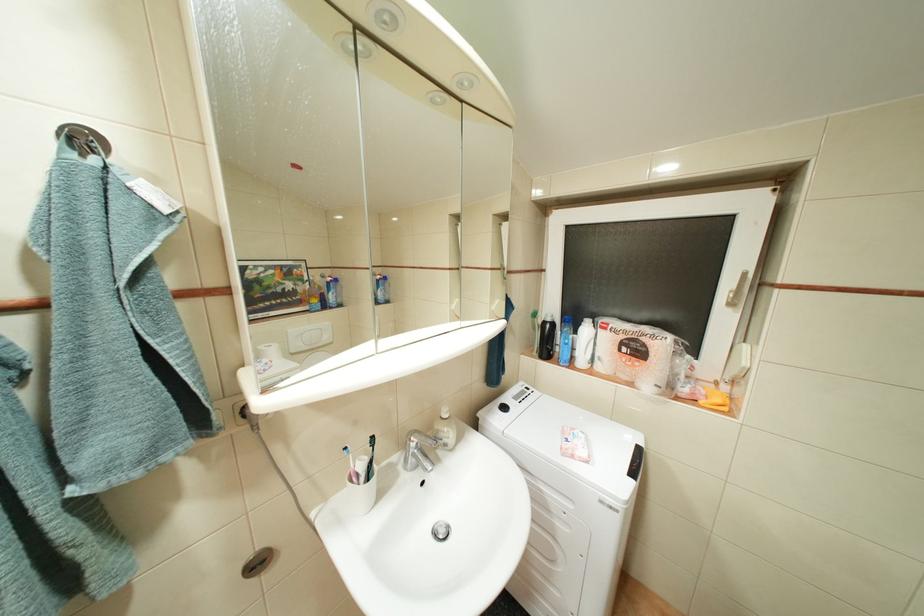
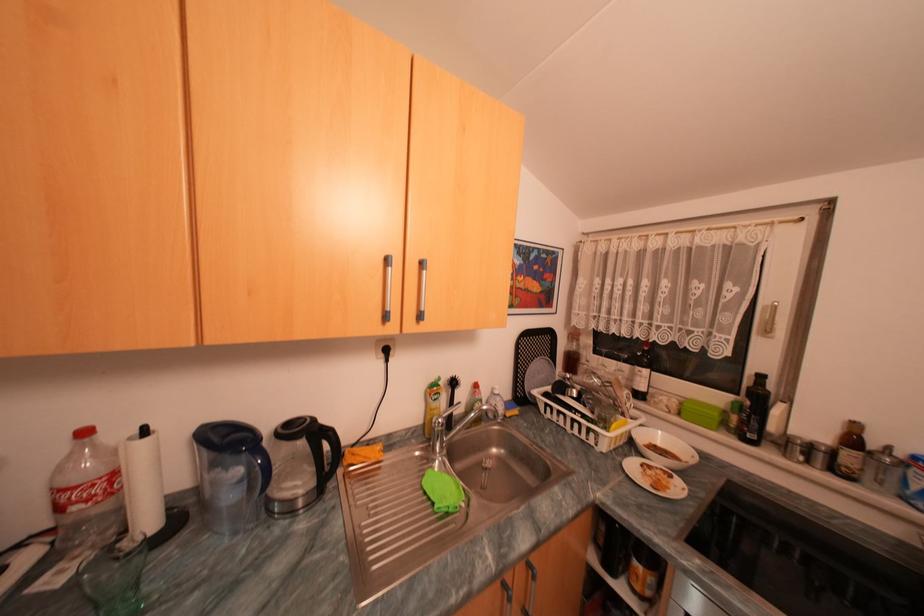
Which direction would the cameraman need to move to produce the second image?

The cameraman moved toward right, backward.